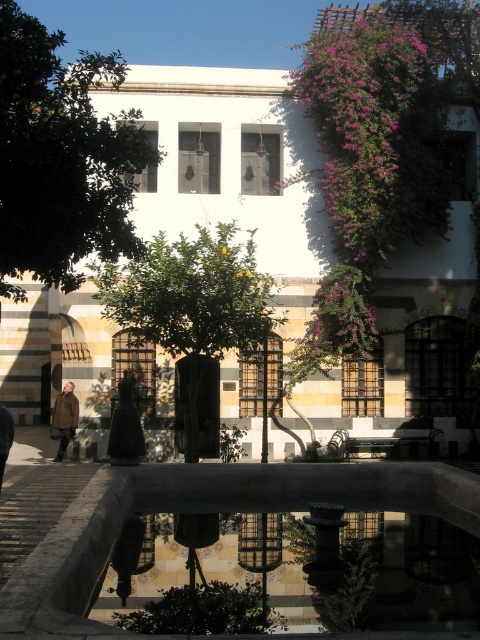
Question: Does green leafy tree at upper left have a greater width compared to brown woolen coat at lower left?

Choices:
 (A) yes
 (B) no

Answer: (A)

Question: In this image, where is green leafy tree at center located relative to brown woolen coat at lower left?

Choices:
 (A) left
 (B) right

Answer: (B)

Question: Can you confirm if brown woolen coat at lower left is wider than brown leather jacket at lower left?

Choices:
 (A) yes
 (B) no

Answer: (A)

Question: Based on their relative distances, which object is farther from the green leafy tree at upper left?

Choices:
 (A) brown woolen coat at lower left
 (B) green leafy tree at center

Answer: (A)

Question: Which of the following is the closest to the observer?

Choices:
 (A) (1, 419)
 (B) (142, 141)
 (C) (154, 317)
 (D) (73, 413)

Answer: (B)

Question: Which object is farther from the camera taking this photo?

Choices:
 (A) green leafy tree at center
 (B) brown woolen coat at lower left
 (C) brown leather jacket at lower left
 (D) green leafy tree at upper left

Answer: (B)